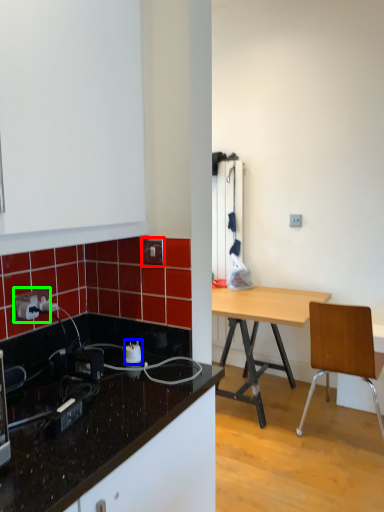
Question: Based on their relative distances, which object is nearer to electric outlet (highlighted by a red box)? Choose from power plugs and sockets (highlighted by a blue box) and power outlet (highlighted by a green box).

Choices:
 (A) power plugs and sockets
 (B) power outlet

Answer: (A)